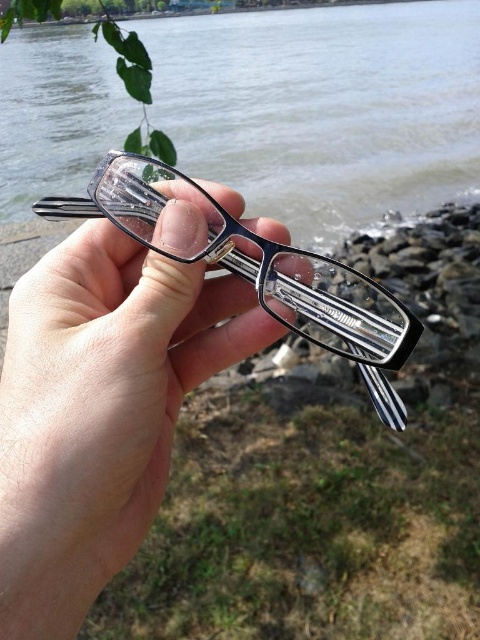
Question: Which object is positioned farthest from the matte black glasses at center?

Choices:
 (A) transparent plastic water at center
 (B) clear plastic glasses at center

Answer: (A)

Question: Considering the relative positions of transparent plastic water at center and matte black glasses at center in the image provided, where is transparent plastic water at center located with respect to matte black glasses at center?

Choices:
 (A) below
 (B) above

Answer: (B)

Question: Considering the relative positions of clear plastic glasses at center and matte black glasses at center in the image provided, where is clear plastic glasses at center located with respect to matte black glasses at center?

Choices:
 (A) right
 (B) left

Answer: (B)

Question: Which object appears farthest from the camera in this image?

Choices:
 (A) matte black glasses at center
 (B) clear plastic glasses at center
 (C) transparent plastic water at center

Answer: (C)

Question: Which of the following is the closest to the observer?

Choices:
 (A) (283, 227)
 (B) (303, 253)

Answer: (B)

Question: Can you confirm if transparent plastic water at center is positioned below clear plastic glasses at center?

Choices:
 (A) yes
 (B) no

Answer: (B)